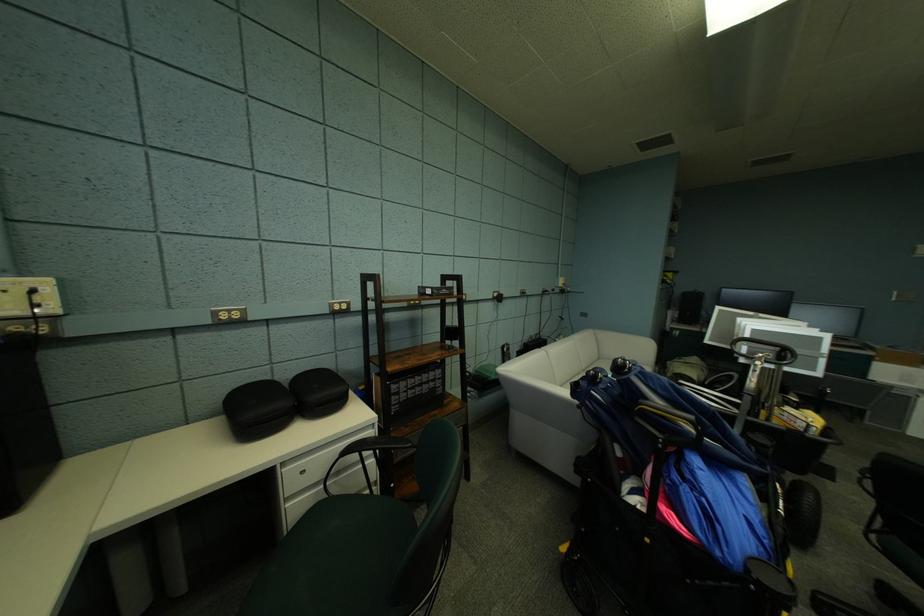
Locate an element on the screen. white drawer handle is located at coordinates (308, 493).